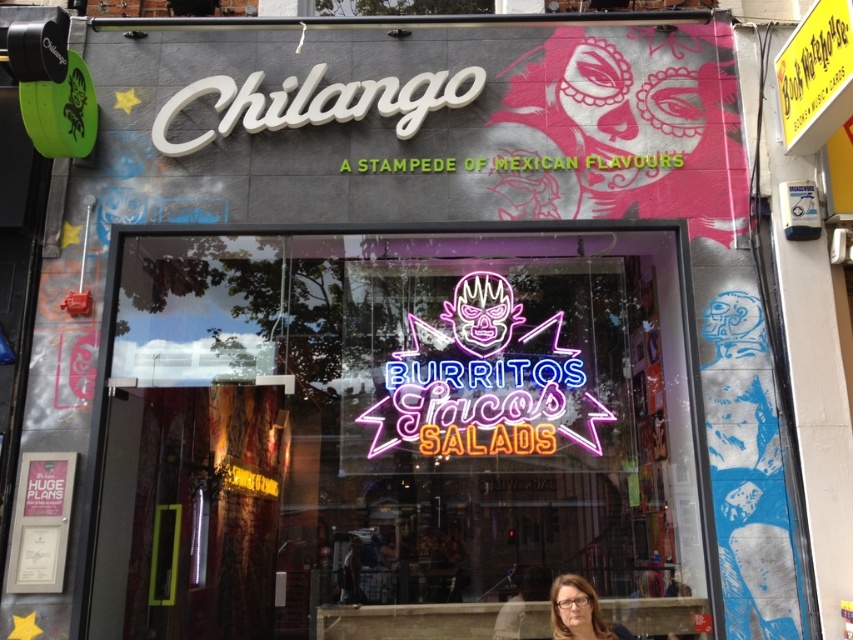
Does neontexturedsign at center have a smaller size compared to matte brown hair at lower center?

No, neontexturedsign at center is not smaller than matte brown hair at lower center.

In the scene shown: Between neontexturedsign at center and matte brown hair at lower center, which one appears on the left side from the viewer's perspective?

Positioned to the left is neontexturedsign at center.

Locate an element on the screen. neontexturedsign at center is located at coordinates (483, 380).

Who is lower down, neon sign at center or matte brown hair at lower center?

matte brown hair at lower center

Does neon sign at center have a greater width compared to matte brown hair at lower center?

Yes, neon sign at center is wider than matte brown hair at lower center.

Between point (498, 460) and point (579, 598), which one is positioned behind?

The point (498, 460) is more distant.

Find the location of a particular element. The height and width of the screenshot is (640, 853). neon sign at center is located at coordinates (397, 435).

The height and width of the screenshot is (640, 853). In order to click on neon sign at center in this screenshot , I will do `click(397, 435)`.

Which is more to the left, neon sign at center or neontexturedsign at center?

neon sign at center

Is point (529, 557) less distant than point (415, 346)?

No, it is not.

Find the location of `neon sign at center`. neon sign at center is located at coordinates [397, 435].